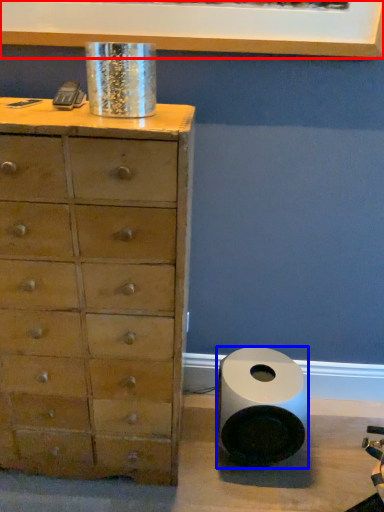
Question: Among these objects, which one is farthest to the camera, picture frame (highlighted by a red box) or speaker (highlighted by a blue box)?

Choices:
 (A) picture frame
 (B) speaker

Answer: (B)